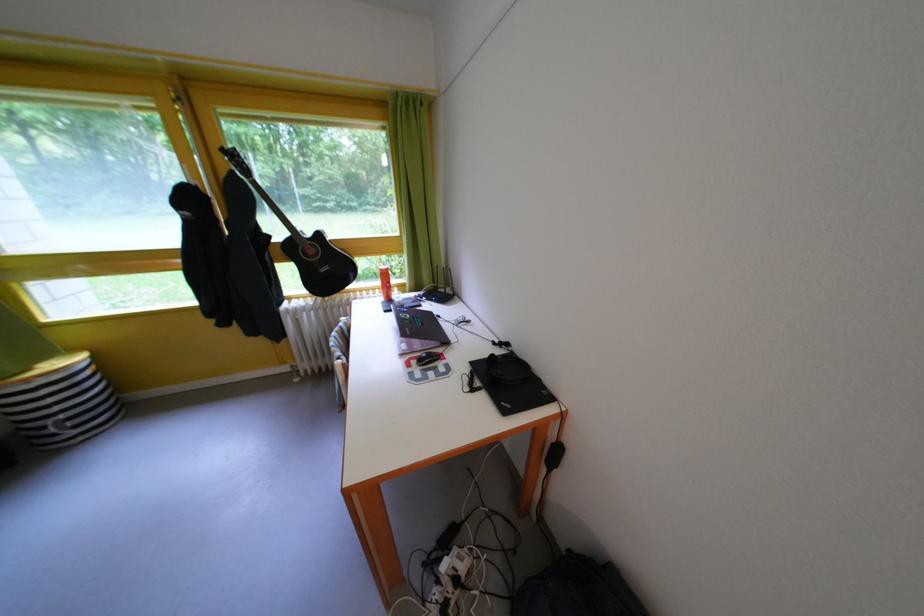
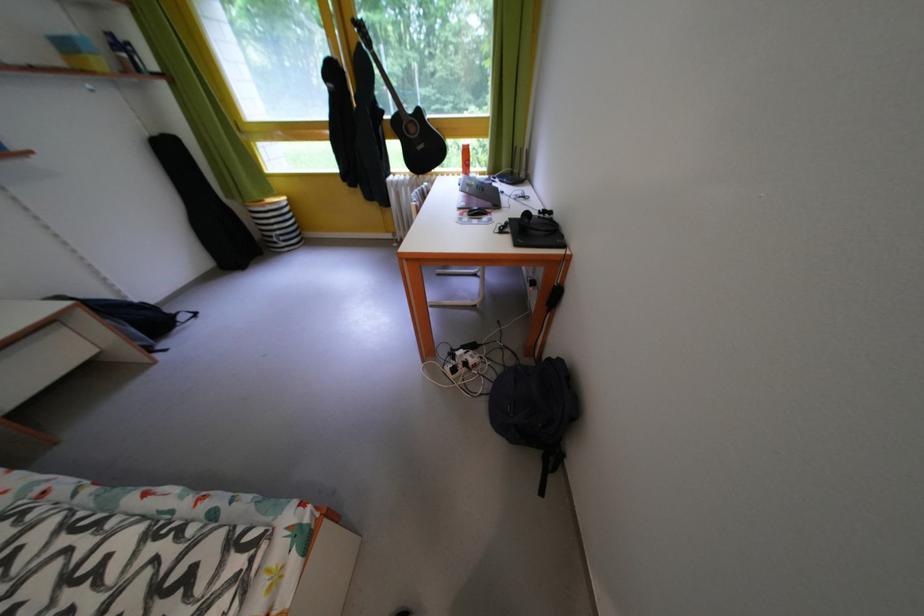
The point at (504, 349) is marked in the first image. Where is the corresponding point in the second image?

(550, 217)